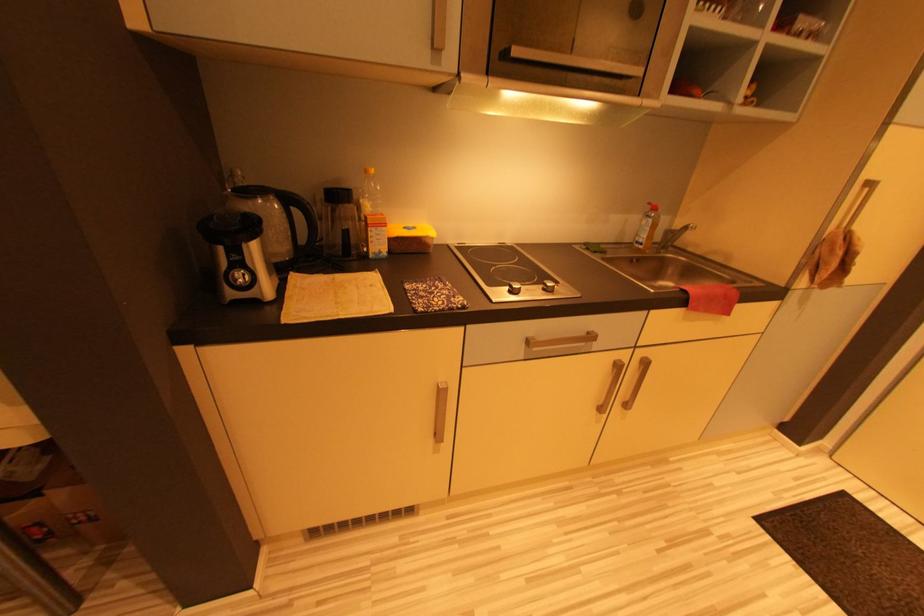
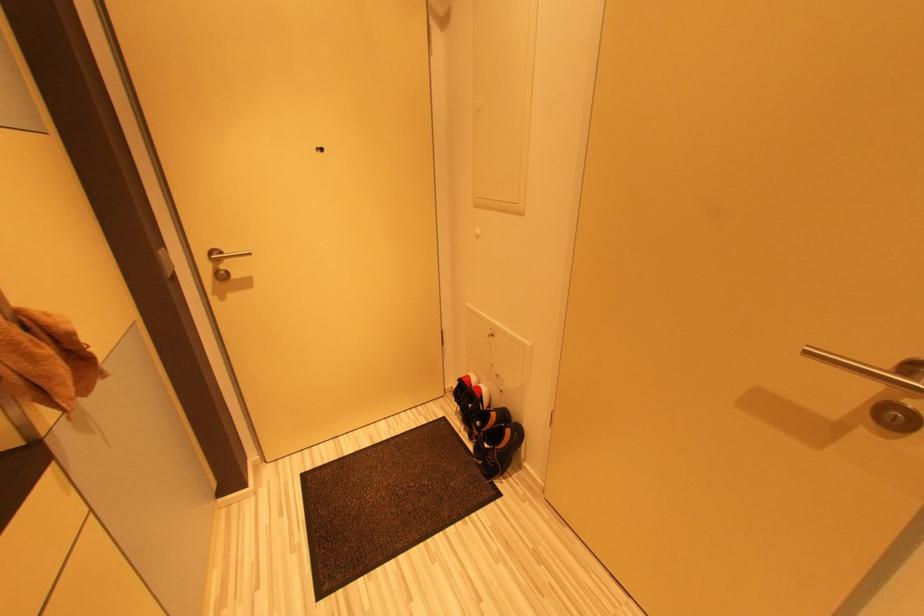
How did the camera likely rotate?

The rotation direction of the camera is right-down.